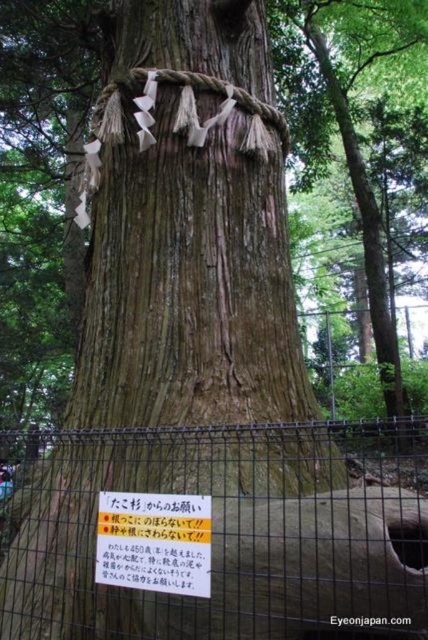
Is point (339, 534) farther from camera compared to point (127, 513)?

That is False.

Between point (356, 515) and point (158, 570), which one is positioned in front?

Point (356, 515) is more forward.

Does point (80, 545) lie behind point (140, 548)?

Yes, point (80, 545) is behind point (140, 548).

Where is `metal wire fence at lower center`? The height and width of the screenshot is (640, 428). metal wire fence at lower center is located at coordinates (216, 532).